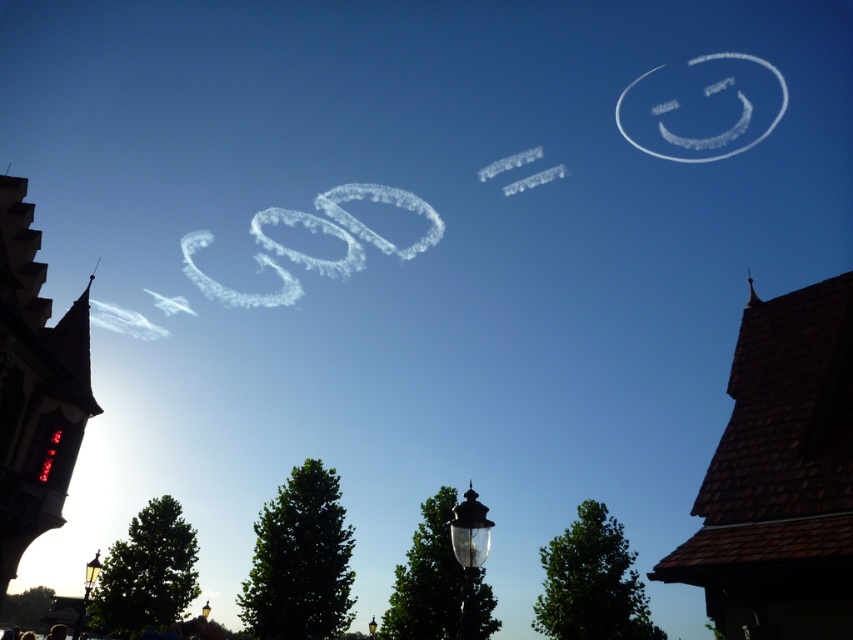
Question: Observing the image, what is the correct spatial positioning of matte black lamp post at lower left in reference to glass lamp post at center?

Choices:
 (A) above
 (B) below

Answer: (A)

Question: Which point is closer to the camera?

Choices:
 (A) (370, 624)
 (B) (473, 557)
 (C) (78, 627)
 (D) (201, 611)

Answer: (B)

Question: Is glass lamp post at center bigger than matte black lamp post at center?

Choices:
 (A) yes
 (B) no

Answer: (B)

Question: Considering the real-world distances, which object is closest to the glass lamp post at center?

Choices:
 (A) matte black lamp post at center
 (B) matte black lamp post at lower left

Answer: (A)

Question: Considering the real-world distances, which object is farthest from the matte black lamp post at lower left?

Choices:
 (A) matte black lamp post at center
 (B) glass lamp post at center

Answer: (B)

Question: Can you confirm if transparent glass lamp post at center is bigger than glass lamp post at center?

Choices:
 (A) yes
 (B) no

Answer: (B)